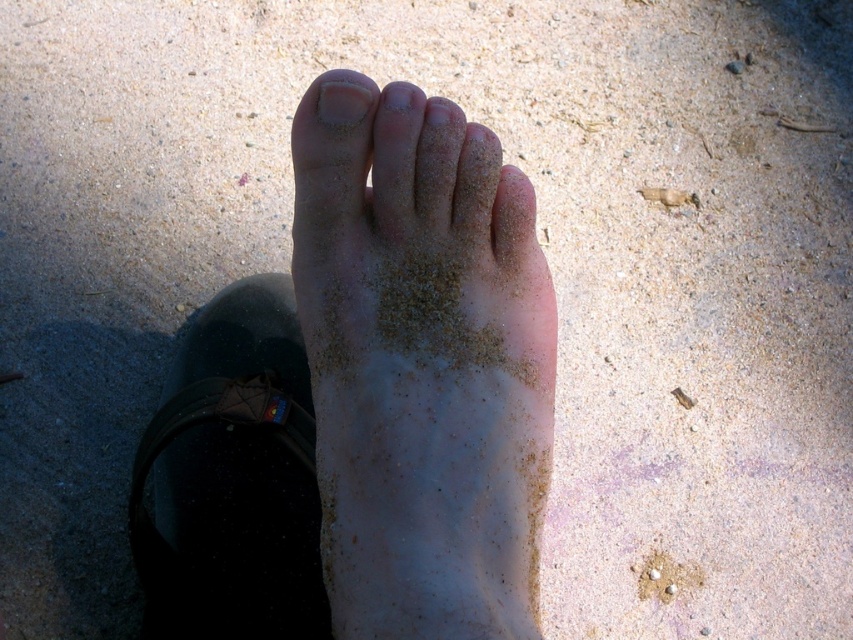
You are a fashion designer observing the image. You need to determine which object is taller between the matte black sandal at lower left and the white matte nail at upper center. Based on the scene, which one is taller?

The matte black sandal at lower left is taller than the white matte nail at upper center according to the description.

You are a photographer trying to capture the white sandy footprint at lower center. However, the matte black sandal at lower left is blocking your view. Can you move the sandal to the side so that the footprint is visible?

The matte black sandal at lower left is in front of the white sandy footprint at lower center. Moving the sandal to the side would allow the footprint to be visible.

Looking at the scene, where is the matte black sandal at lower left in relation to the white matte nail at upper center?

The matte black sandal at lower left is to the left of the white matte nail at upper center.